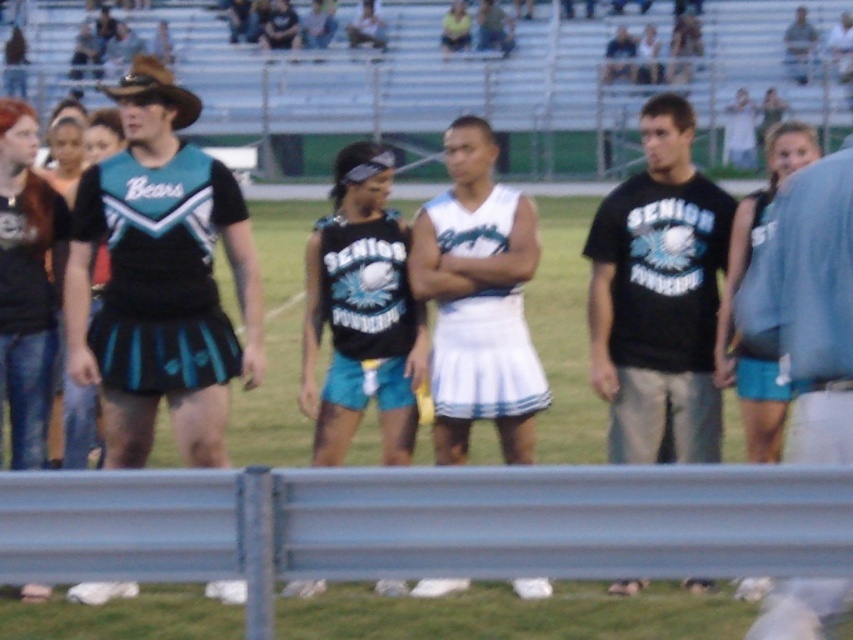
You are a photographer positioned behind the metal barrier in the foreground. You want to take a photo that includes both the blue denim shorts at right and the brown leather cowboy hat at upper left. What is the minimum distance you need to move backward to ensure both objects are in frame?

The blue denim shorts at right is 3.10 meters away from the brown leather cowboy hat at upper left. To include both in the frame, you need to move backward until both are within your camera lens view. The exact distance depends on your camera lens, but moving back at least 3.10 meters from the closer object would ensure both are visible.

Based on the photo, you are standing at the metal barrier in the foreground of the sports field. You see two points marked on the field, point 1 at coordinates point (816,307) and point 2 at coordinates point (181,113). Which point is closer to you?

Point (816,307) is closer to the camera than point (181,113), so the point closer to you is point (816,307).